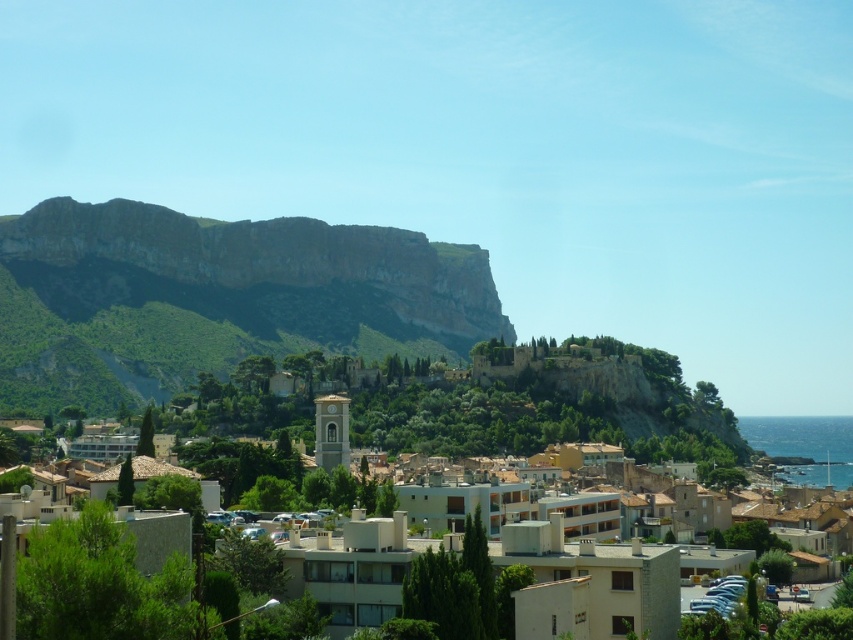
Question: In this image, where is rugged stone cliff at left located relative to smooth stone bell tower at center?

Choices:
 (A) right
 (B) left

Answer: (B)

Question: Which object is farther from the camera taking this photo?

Choices:
 (A) beige stone town at center
 (B) smooth stone bell tower at center

Answer: (B)

Question: Which of the following is the closest to the observer?

Choices:
 (A) rugged stone cliff at left
 (B) smooth stone bell tower at center
 (C) beige stone town at center

Answer: (C)

Question: Which object is farther from the camera taking this photo?

Choices:
 (A) beige stone town at center
 (B) smooth stone bell tower at center

Answer: (B)

Question: In this image, where is beige stone town at center located relative to smooth stone bell tower at center?

Choices:
 (A) above
 (B) below

Answer: (B)

Question: Does rugged stone cliff at left appear on the left side of smooth stone bell tower at center?

Choices:
 (A) yes
 (B) no

Answer: (A)